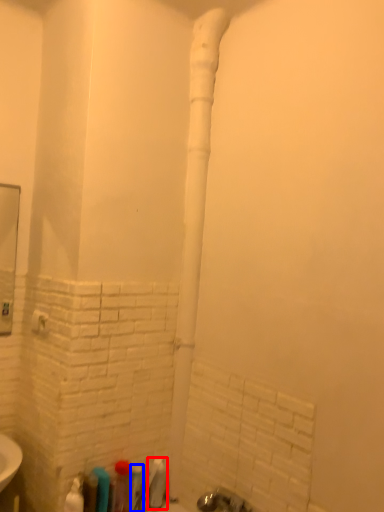
Question: Which of the following is the farthest to the observer, toiletry (highlighted by a red box) or toiletry (highlighted by a blue box)?

Choices:
 (A) toiletry
 (B) toiletry

Answer: (A)